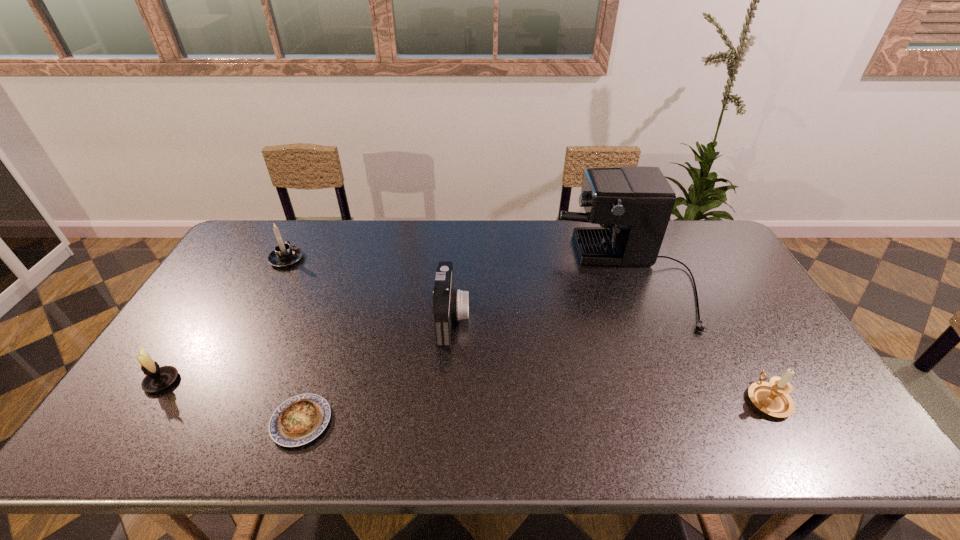
Image resolution: width=960 pixels, height=540 pixels. Find the location of `coffee maker that is at the far edge`. coffee maker that is at the far edge is located at coordinates (633, 205).

The image size is (960, 540). What are the coordinates of `candle holder that is at the far edge` in the screenshot? It's located at (284, 255).

Identify the location of candle holder that is at the near edge. This screenshot has width=960, height=540. (772, 397).

This screenshot has width=960, height=540. I want to click on quiche that is at the near edge, so click(297, 421).

I want to click on object that is at the right edge, so click(x=772, y=397).

Where is `object located in the far left corner section of the desktop`? The width and height of the screenshot is (960, 540). object located in the far left corner section of the desktop is located at coordinates (284, 255).

Find the location of a particular element. The image size is (960, 540). object present at the near right corner is located at coordinates (772, 397).

Where is `free space at the far edge of the desktop`? This screenshot has height=540, width=960. free space at the far edge of the desktop is located at coordinates (396, 258).

What are the coordinates of `free space at the near edge of the desktop` in the screenshot? It's located at (759, 422).

In the image, there is a desktop. Identify the location of vacant space at the right edge. (740, 350).